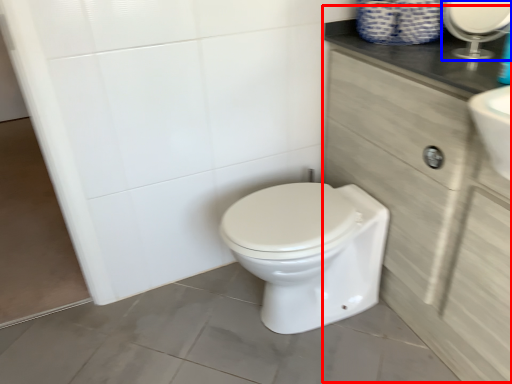
Question: Which object appears farthest to the camera in this image, cabinetry (highlighted by a red box) or mirror (highlighted by a blue box)?

Choices:
 (A) cabinetry
 (B) mirror

Answer: (B)